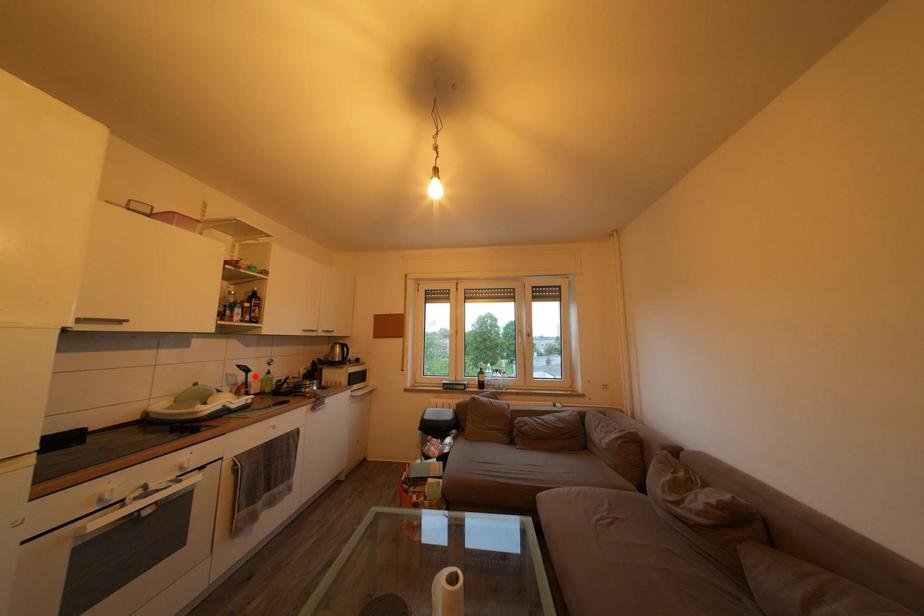
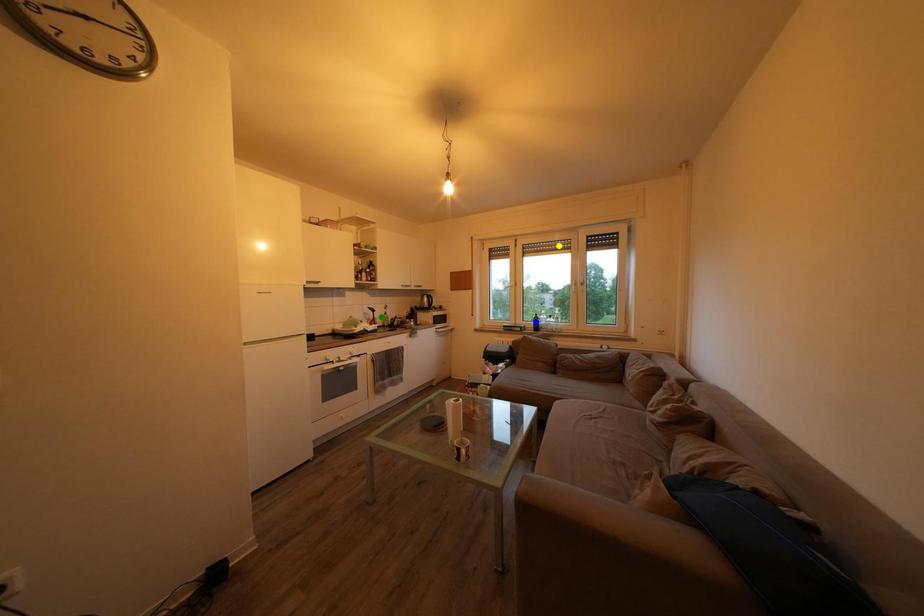
Question: I am providing you with two images of the same scene from different viewpoints. A red point is marked on the first image. You are given multiple points on the second image. In image 2, which mark is for the same physical point as the one in image 1?

Choices:
 (A) blue point
 (B) green point
 (C) yellow point

Answer: (B)